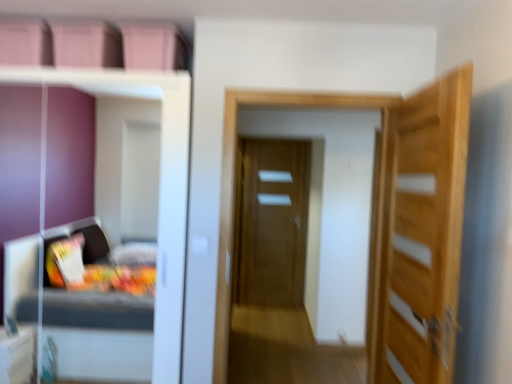
Question: Is light wood door at right, which is counted as the second door, starting from the back, in front of or behind transparent glass door at center in the image?

Choices:
 (A) front
 (B) behind

Answer: (A)

Question: Visually, is light wood door at right, the 1th door from the front, positioned to the left or to the right of transparent glass door at center?

Choices:
 (A) right
 (B) left

Answer: (A)

Question: Which object is positioned closest to the light wood door at right, which is counted as the second door, starting from the left?

Choices:
 (A) white glossy dresser at left
 (B) matte wooden door at center, arranged as the first door when viewed from the left
 (C) transparent glass door at center

Answer: (C)

Question: Considering the real-world distances, which object is closest to the white glossy dresser at left?

Choices:
 (A) light wood door at right, which is counted as the second door, starting from the back
 (B) matte wooden door at center, the 1th door positioned from the back
 (C) transparent glass door at center

Answer: (C)